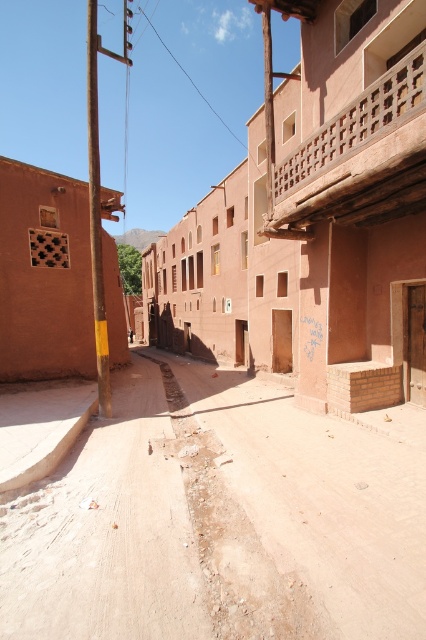
Question: Considering the real-world distances, which object is farthest from the matte clay building at center?

Choices:
 (A) dull orange dirt at center
 (B) dusty sand at center

Answer: (B)

Question: Is matte clay building at center positioned in front of dusty sand at center?

Choices:
 (A) yes
 (B) no

Answer: (B)

Question: Based on their relative distances, which object is nearer to the dusty sand at center?

Choices:
 (A) matte clay building at center
 (B) dull orange dirt at center

Answer: (B)

Question: Does dull orange dirt at center have a larger size compared to matte clay building at center?

Choices:
 (A) no
 (B) yes

Answer: (A)

Question: Which of the following is the farthest from the observer?

Choices:
 (A) dusty sand at center
 (B) matte clay building at center

Answer: (B)

Question: Does dull orange dirt at center have a smaller size compared to matte clay building at center?

Choices:
 (A) yes
 (B) no

Answer: (A)